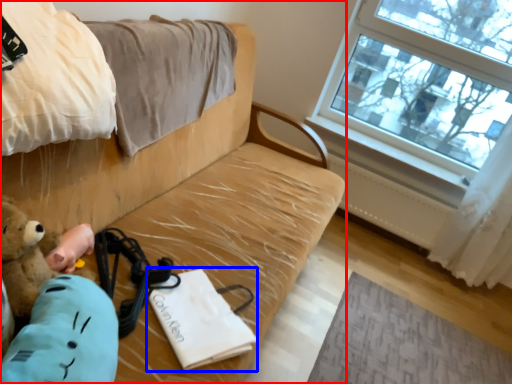
Question: Which of the following is the closest to the observer, studio couch (highlighted by a red box) or journal (highlighted by a blue box)?

Choices:
 (A) studio couch
 (B) journal

Answer: (A)